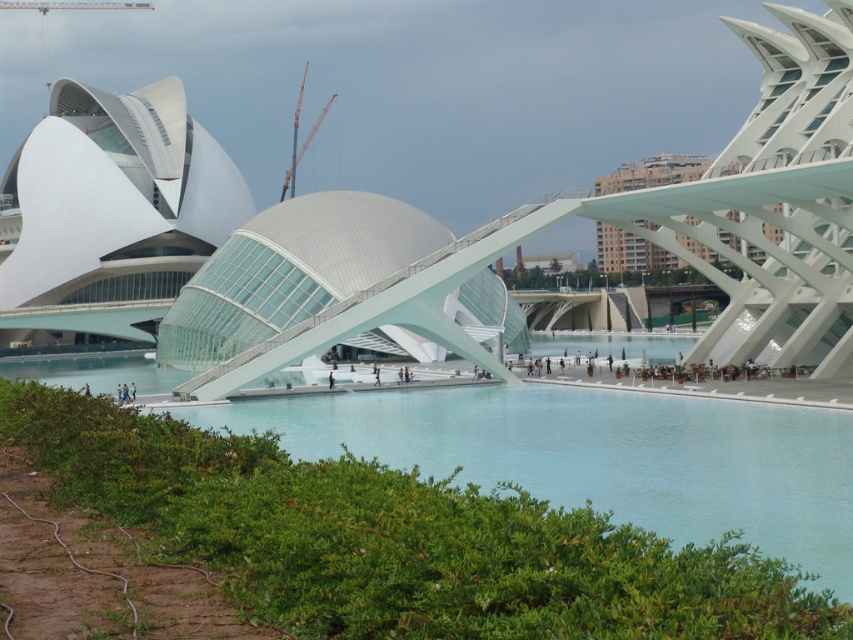
Question: Which of the following is the farthest from the observer?

Choices:
 (A) white glass dome at center
 (B) clear blue water at center

Answer: (A)

Question: Among these objects, which one is nearest to the camera?

Choices:
 (A) orange metallic crane at center
 (B) clear blue water at center
 (C) white glass dome at center

Answer: (B)

Question: Which object is positioned farthest from the orange metallic crane at center?

Choices:
 (A) white glass dome at center
 (B) clear blue water at center

Answer: (B)

Question: Is clear blue water at center smaller than white glass dome at center?

Choices:
 (A) no
 (B) yes

Answer: (B)

Question: Is white glass dome at center closer to the viewer compared to orange metallic crane at center?

Choices:
 (A) yes
 (B) no

Answer: (A)

Question: Considering the relative positions of clear blue water at center and orange metallic crane at center in the image provided, where is clear blue water at center located with respect to orange metallic crane at center?

Choices:
 (A) right
 (B) left

Answer: (A)